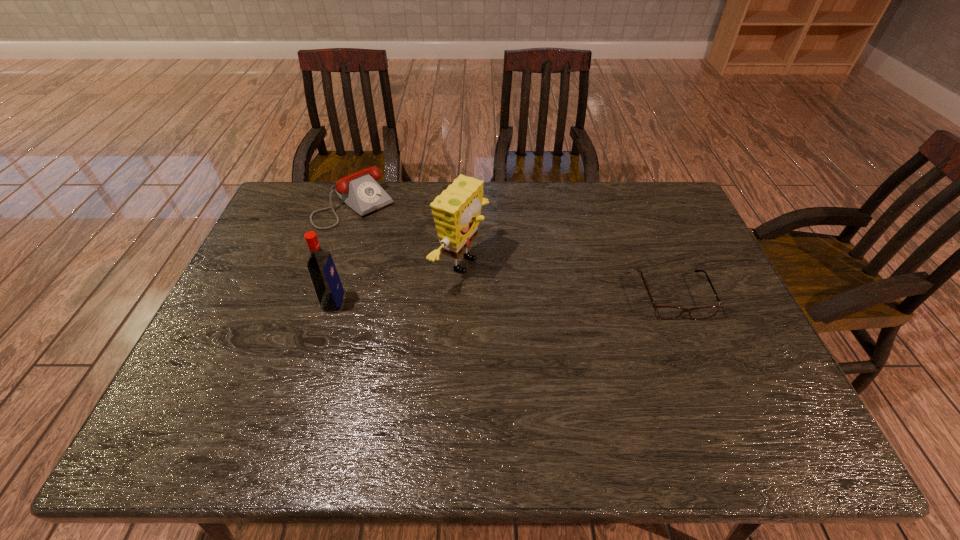
The width and height of the screenshot is (960, 540). I want to click on vodka, so click(x=325, y=279).

Locate an element on the screen. The width and height of the screenshot is (960, 540). the rightmost object is located at coordinates (662, 312).

The height and width of the screenshot is (540, 960). Find the location of `the shortest object`. the shortest object is located at coordinates (662, 312).

You are a GUI agent. You are given a task and a screenshot of the screen. Output one action in this format:
    pyautogui.click(x=<x>, y=<y>)
    Task: Click on the third object from left to right
    This screenshot has height=540, width=960.
    Given the screenshot: What is the action you would take?
    pyautogui.click(x=456, y=211)

I want to click on telephone, so click(x=360, y=191).

Identify the location of the farthest object. The width and height of the screenshot is (960, 540). (360, 191).

What are the coordinates of `free spot located 0.130m on the front and back of the vodka` in the screenshot? It's located at (277, 302).

Image resolution: width=960 pixels, height=540 pixels. I want to click on free space located on the front and back of the vodka, so click(263, 302).

The image size is (960, 540). Find the location of `free space located on the front and back of the vodka`. free space located on the front and back of the vodka is located at coordinates (284, 302).

You are a GUI agent. You are given a task and a screenshot of the screen. Output one action in this format:
    pyautogui.click(x=<x>, y=<y>)
    Task: Click on the vacant space located on the lenses of the shortest object
    Image resolution: width=960 pixels, height=540 pixels.
    Given the screenshot: What is the action you would take?
    (692, 342)